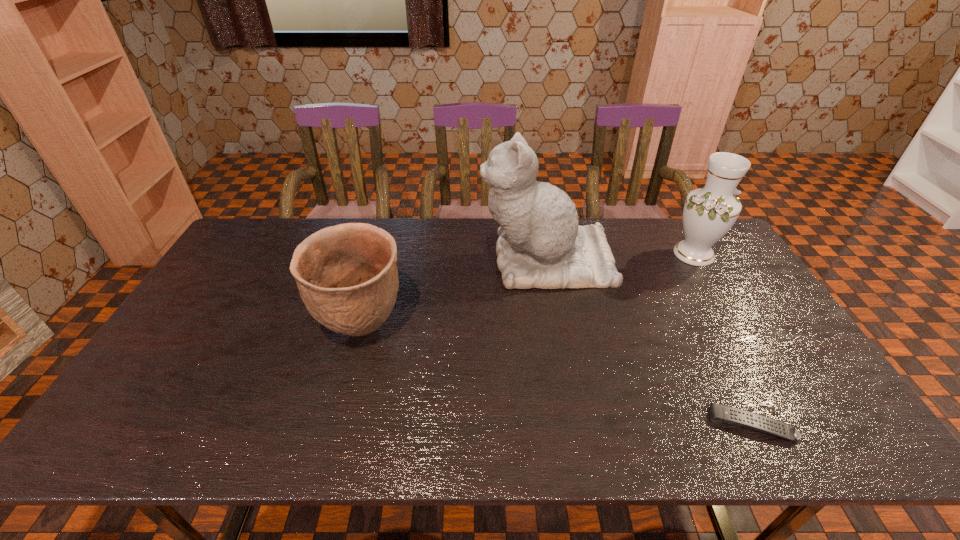
The image size is (960, 540). I want to click on free spot located 0.380m on the front of the vase, so click(x=760, y=365).

Locate an element on the screen. vacant space located 0.350m on the back of the leftmost object is located at coordinates (389, 231).

Image resolution: width=960 pixels, height=540 pixels. What are the coordinates of `free region located on the back of the shortest object` in the screenshot? It's located at (710, 345).

Identify the location of cat at the far edge. (541, 245).

Locate an element on the screen. vase at the far edge is located at coordinates (709, 212).

You are a GUI agent. You are given a task and a screenshot of the screen. Output one action in this format:
    pyautogui.click(x=<x>, y=<y>)
    Task: Click on the object that is at the near edge
    
    Given the screenshot: What is the action you would take?
    pyautogui.click(x=719, y=413)

This screenshot has height=540, width=960. Find the location of `vase that is at the right edge`. vase that is at the right edge is located at coordinates (709, 212).

Locate an element on the screen. This screenshot has height=540, width=960. remote control situated at the right edge is located at coordinates (719, 413).

I want to click on object at the far right corner, so click(709, 212).

Image resolution: width=960 pixels, height=540 pixels. Find the location of `object at the near right corner`. object at the near right corner is located at coordinates (719, 413).